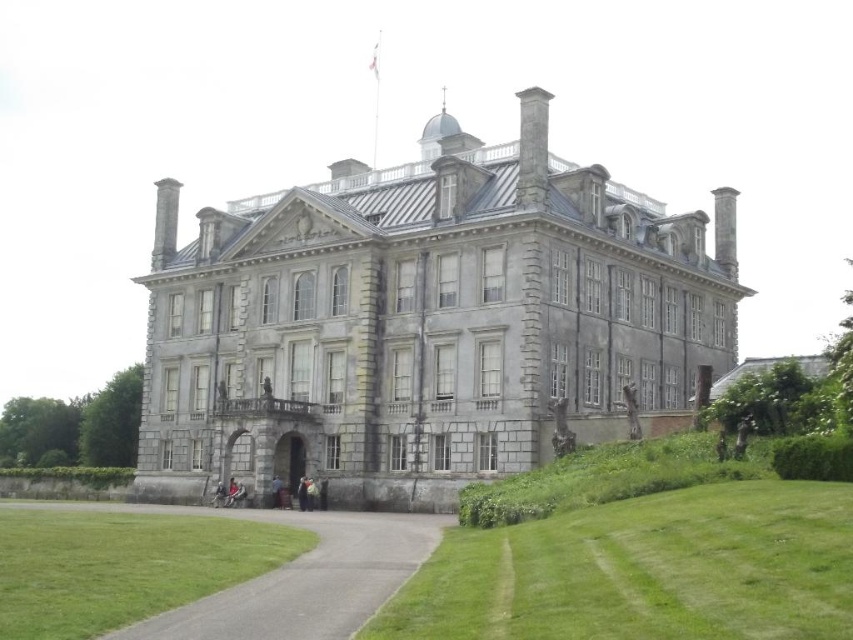
Is gray stone mansion at center thinner than dark blue fabric jacket at center?

Incorrect, gray stone mansion at center's width is not less than dark blue fabric jacket at center's.

Which is behind, point (169, 420) or point (276, 496)?

The point (169, 420) is more distant.

Where is `gray stone mansion at center`? gray stone mansion at center is located at coordinates (424, 321).

Does gray stone mansion at center have a greater width compared to gray asphalt driveway at lower center?

Yes.

In the scene shown: Measure the distance between point (360, 344) and camera.

Point (360, 344) is 210.94 feet away from camera.

This screenshot has width=853, height=640. I want to click on gray stone mansion at center, so click(424, 321).

Which is below, gray asphalt driveway at lower center or dark blue fabric jacket at center?

dark blue fabric jacket at center is lower down.

Who is shorter, gray asphalt driveway at lower center or dark blue fabric jacket at center?

With less height is dark blue fabric jacket at center.

Who is more forward, (230, 636) or (280, 481)?

Point (230, 636) is in front.

Identify the location of gray asphalt driveway at lower center. This screenshot has height=640, width=853. (302, 579).